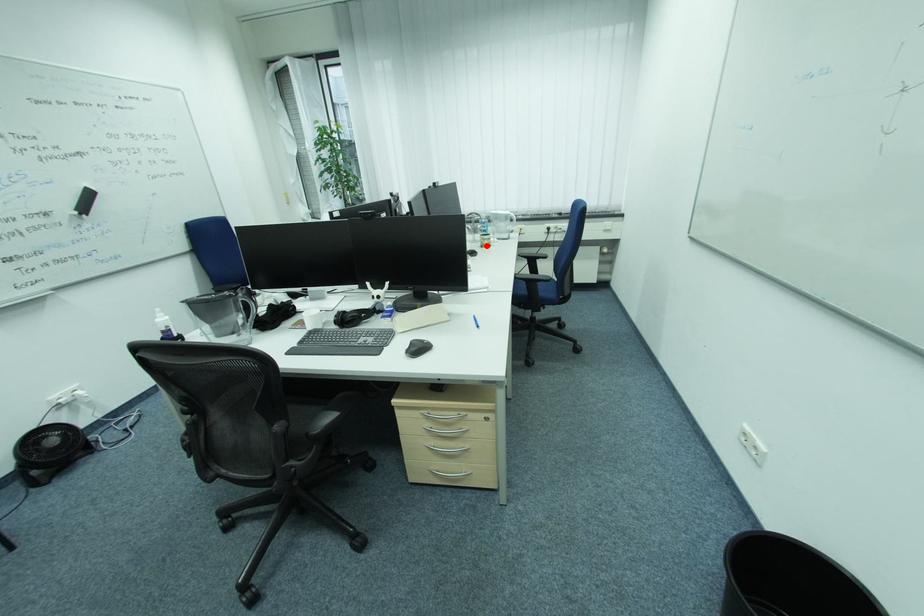
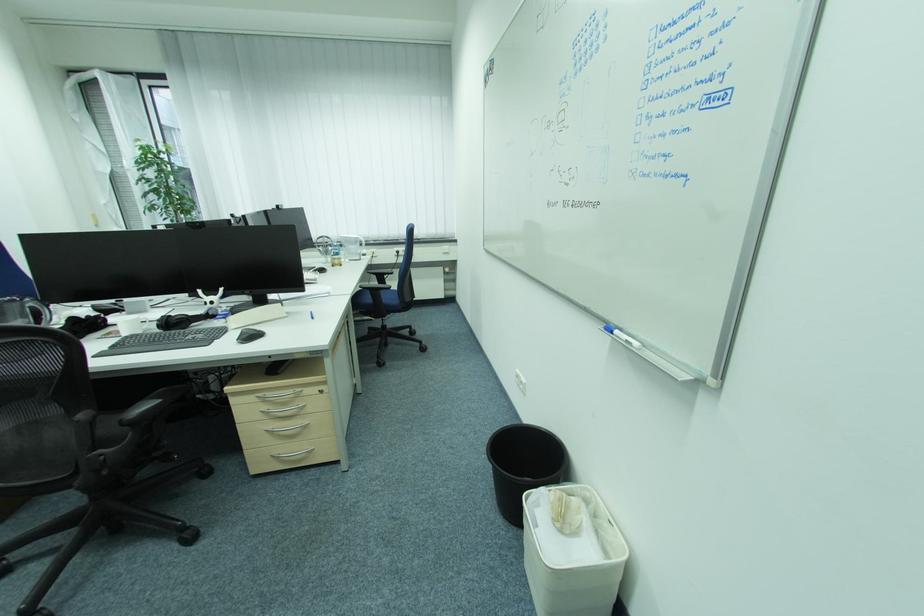
Locate, in the second image, the point that corresponds to the highlighted location in the first image.

(337, 265)